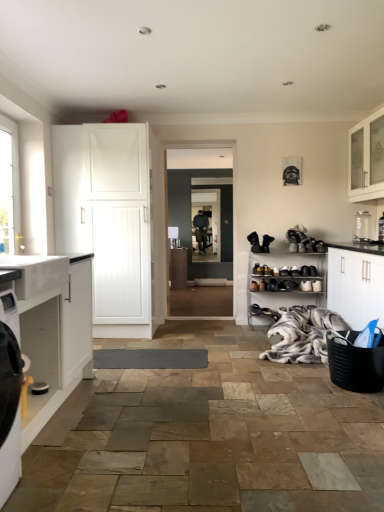
Question: Do you think white fur blanket at lower right is within matte black shoe at lower center, the fourth shoe from the right, or outside of it?

Choices:
 (A) outside
 (B) inside

Answer: (A)

Question: Visually, is white fur blanket at lower right positioned to the left or to the right of matte black shoe at lower center, the fourth shoe from the right?

Choices:
 (A) right
 (B) left

Answer: (A)

Question: Which of these objects is positioned closest to the black leather shoe at center, which is the 6th shoe from left to right?

Choices:
 (A) white glass cabinet at upper right, which ranks as the first cabinetry in right-to-left order
 (B) clear glass container at upper right
 (C) matte black shoe at lower center, the fourth shoe from the right
 (D) metallic silver shoe rack at lower right, the second cabinetry from the back
 (E) shiny black shoe at center, acting as the fifth shoe starting from the right

Answer: (D)

Question: Which object is the farthest from the black leather shoe at lower right, which is the 1th shoe from right to left?

Choices:
 (A) white matte cabinet at left, positioned as the 2th cabinetry in left-to-right order
 (B) shiny black shoe at center, acting as the fifth shoe starting from the right
 (C) brown leather shoe at lower center, arranged as the 6th shoe when viewed from the right
 (D) white matte shoe at lower right, which ranks as the third shoe in right-to-left order
 (E) black leather shoe at center

Answer: (A)